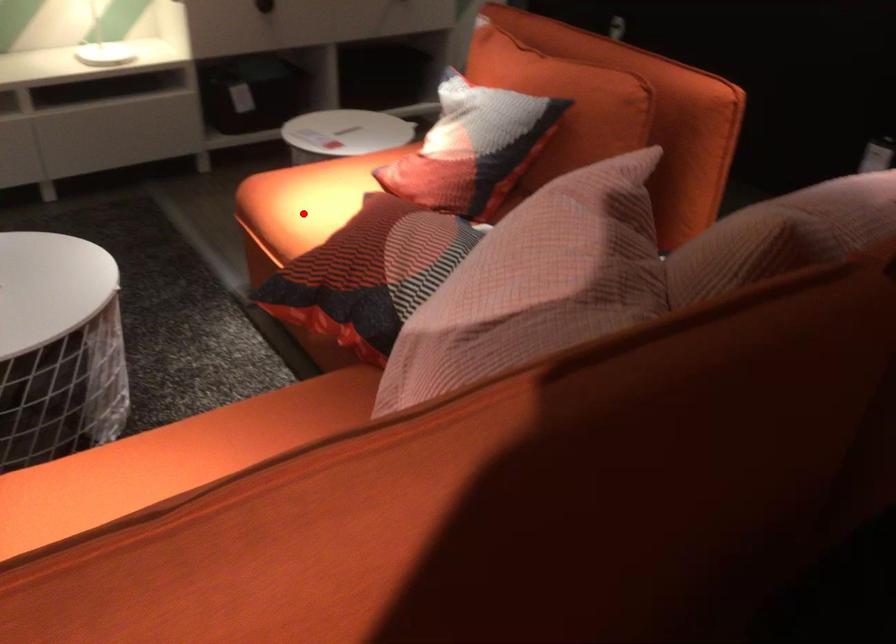
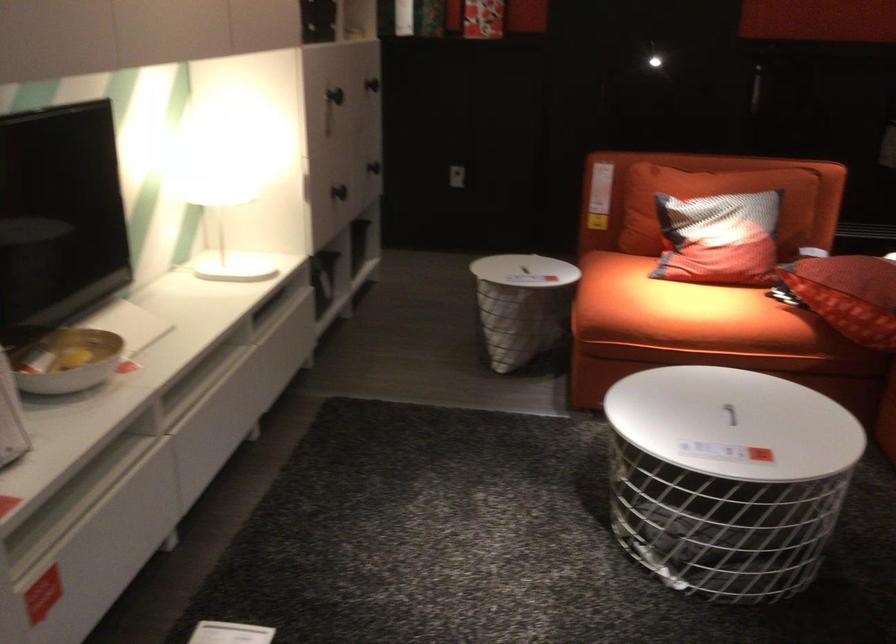
Question: I am providing you with two images of the same scene from different viewpoints. Given a red point in image1, look at the same physical point in image2. Is it:

Choices:
 (A) Closer to the viewpoint
 (B) Farther from the viewpoint

Answer: (B)